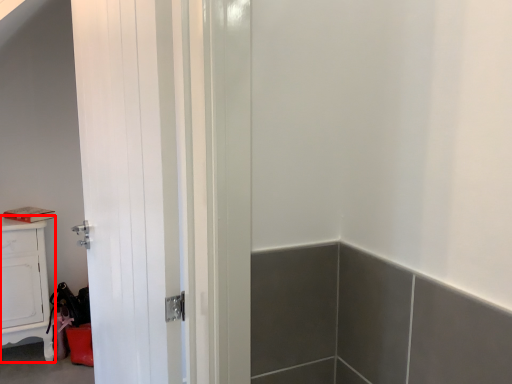
Question: From the image, what is the correct spatial relationship of cabinetry (annotated by the red box) in relation to door?

Choices:
 (A) right
 (B) left

Answer: (B)